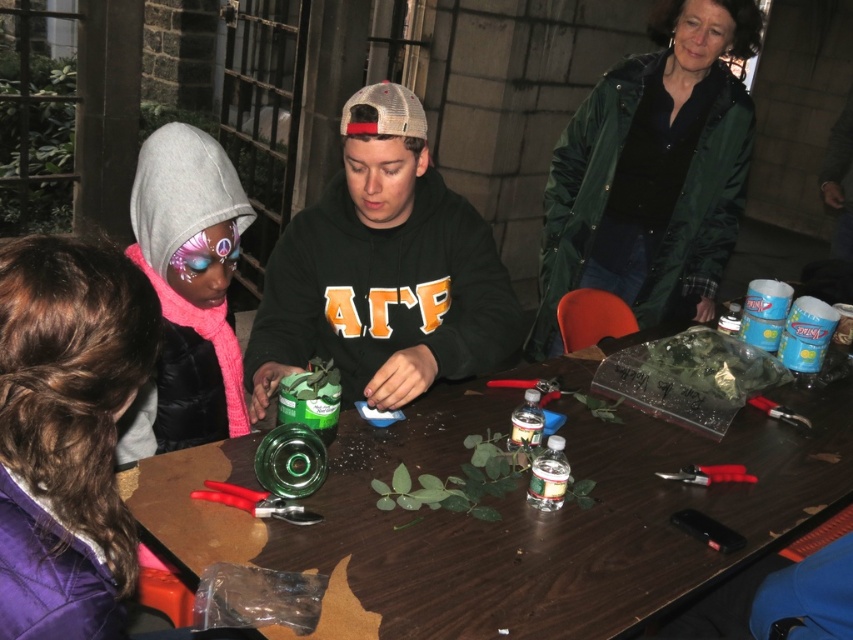
Question: Is brown wooden table at center behind green matte sweatshirt at center?

Choices:
 (A) no
 (B) yes

Answer: (A)

Question: Estimate the real-world distances between objects in this image. Which object is farther from the green matte sweatshirt at upper right?

Choices:
 (A) brown wooden table at center
 (B) green matte sweatshirt at center
 (C) matte pink scarf at lower left

Answer: (C)

Question: Based on their relative distances, which object is nearer to the green matte sweatshirt at center?

Choices:
 (A) matte pink scarf at lower left
 (B) brown wooden table at center

Answer: (A)

Question: Does brown wooden table at center appear under green matte sweatshirt at center?

Choices:
 (A) yes
 (B) no

Answer: (A)

Question: Estimate the real-world distances between objects in this image. Which object is farther from the green matte sweatshirt at upper right?

Choices:
 (A) matte pink scarf at lower left
 (B) brown wooden table at center
 (C) green matte sweatshirt at center

Answer: (A)

Question: Does green matte sweatshirt at center appear on the right side of green matte sweatshirt at upper right?

Choices:
 (A) no
 (B) yes

Answer: (A)